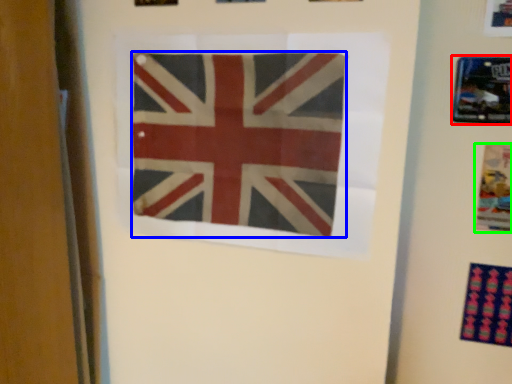
Question: Which object is the farthest from picture frame (highlighted by a red box)? Choose among these: flag (highlighted by a blue box) or poster (highlighted by a green box).

Choices:
 (A) flag
 (B) poster

Answer: (A)